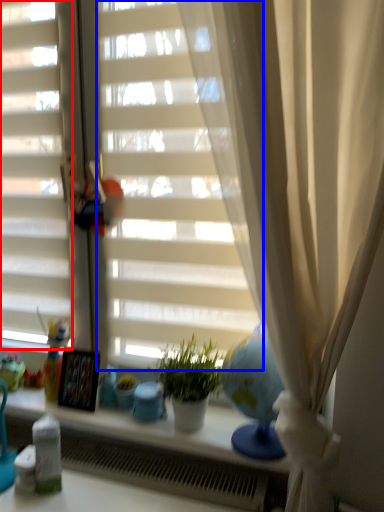
Question: Among these objects, which one is nearest to the camera, shutter (highlighted by a red box) or blind (highlighted by a blue box)?

Choices:
 (A) shutter
 (B) blind

Answer: (B)